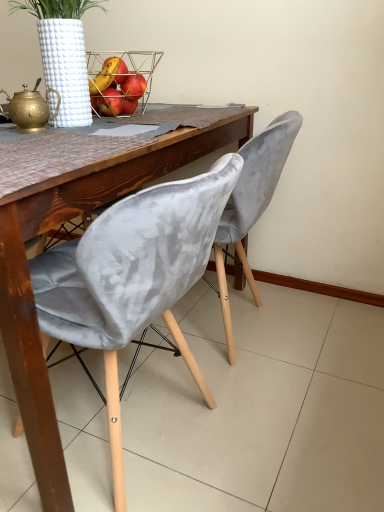
Locate an element on the screen. Image resolution: width=384 pixels, height=512 pixels. velvet grey chair at center, which is the 1th chair in back-to-front order is located at coordinates (252, 203).

This screenshot has height=512, width=384. What do you see at coordinates (120, 80) in the screenshot? I see `metallic wire basket at upper center` at bounding box center [120, 80].

Looking at this image, measure the distance between point (93,71) and camera.

Point (93,71) is 1.57 meters from camera.

Locate an element on the screen. The image size is (384, 512). velvet grey chair at center, positioned as the second chair in back-to-front order is located at coordinates (133, 273).

Between velvet grey chair at center, which is the 1th chair in back-to-front order, and velvet grey chair at center, positioned as the second chair in back-to-front order, which one appears on the left side from the viewer's perspective?

velvet grey chair at center, positioned as the second chair in back-to-front order, is more to the left.

From a real-world perspective, which is physically above, velvet grey chair at center, which is the 1th chair in back-to-front order, or velvet grey chair at center, which ranks as the 1th chair in front-to-back order?

In real-world perspective, velvet grey chair at center, which is the 1th chair in back-to-front order, is above.

In the scene shown: Considering the relative sizes of velvet grey chair at center, which is the 1th chair in back-to-front order, and velvet grey chair at center, positioned as the second chair in back-to-front order, in the image provided, is velvet grey chair at center, which is the 1th chair in back-to-front order, wider than velvet grey chair at center, positioned as the second chair in back-to-front order,?

No.

Does point (252, 218) come behind point (81, 287)?

Yes, it is behind point (81, 287).

Is velvet grey chair at center, which ranks as the 1th chair in front-to-back order, turned away from velvet grey chair at center, which is the 1th chair in back-to-front order?

No, velvet grey chair at center, which ranks as the 1th chair in front-to-back order, is not facing away from velvet grey chair at center, which is the 1th chair in back-to-front order.

Which is in front, velvet grey chair at center, positioned as the second chair in back-to-front order, or velvet grey chair at center, acting as the second chair starting from the front?

velvet grey chair at center, positioned as the second chair in back-to-front order, is closer to the camera.

Considering the relative sizes of velvet grey chair at center, positioned as the second chair in back-to-front order, and velvet grey chair at center, acting as the second chair starting from the front, in the image provided, is velvet grey chair at center, positioned as the second chair in back-to-front order, smaller than velvet grey chair at center, acting as the second chair starting from the front,?

No, velvet grey chair at center, positioned as the second chair in back-to-front order, is not smaller than velvet grey chair at center, acting as the second chair starting from the front.

From the image's perspective, which is above, velvet grey chair at center, which ranks as the 1th chair in front-to-back order, or velvet grey chair at center, acting as the second chair starting from the front?

velvet grey chair at center, acting as the second chair starting from the front.

How much distance is there between metallic wire basket at upper center and velvet grey chair at center, acting as the second chair starting from the front?

metallic wire basket at upper center and velvet grey chair at center, acting as the second chair starting from the front, are 19.96 inches apart from each other.

Considering the relative sizes of metallic wire basket at upper center and velvet grey chair at center, acting as the second chair starting from the front, in the image provided, is metallic wire basket at upper center shorter than velvet grey chair at center, acting as the second chair starting from the front,?

Yes, metallic wire basket at upper center is shorter than velvet grey chair at center, acting as the second chair starting from the front.

Does metallic wire basket at upper center appear on the right side of velvet grey chair at center, which is the 1th chair in back-to-front order?

No, metallic wire basket at upper center is not to the right of velvet grey chair at center, which is the 1th chair in back-to-front order.

Locate an element on the screen. Image resolution: width=384 pixels, height=512 pixels. basket on the left side of velvet grey chair at center, which is the 1th chair in back-to-front order is located at coordinates (120, 80).

Does velvet grey chair at center, positioned as the second chair in back-to-front order, appear on the left side of metallic wire basket at upper center?

Incorrect, velvet grey chair at center, positioned as the second chair in back-to-front order, is not on the left side of metallic wire basket at upper center.

From the image's perspective, is velvet grey chair at center, positioned as the second chair in back-to-front order, over metallic wire basket at upper center?

No, from the image's perspective, velvet grey chair at center, positioned as the second chair in back-to-front order, is not over metallic wire basket at upper center.

The height and width of the screenshot is (512, 384). What are the coordinates of `the 1st chair counting from the right of the metallic wire basket at upper center` in the screenshot? It's located at (x=133, y=273).

Between velvet grey chair at center, which ranks as the 1th chair in front-to-back order, and metallic wire basket at upper center, which one has smaller size?

metallic wire basket at upper center is smaller.

Looking at this image, considering the positions of objects velvet grey chair at center, which is the 1th chair in back-to-front order, and metallic wire basket at upper center in the image provided, who is in front, velvet grey chair at center, which is the 1th chair in back-to-front order, or metallic wire basket at upper center?

velvet grey chair at center, which is the 1th chair in back-to-front order, is in front.

Looking at this image, would you say metallic wire basket at upper center is part of velvet grey chair at center, acting as the second chair starting from the front,'s contents?

No, metallic wire basket at upper center is not a part of velvet grey chair at center, acting as the second chair starting from the front.

Is velvet grey chair at center, which is the 1th chair in back-to-front order, oriented away from metallic wire basket at upper center?

velvet grey chair at center, which is the 1th chair in back-to-front order, does not have its back to metallic wire basket at upper center.

Which is correct: metallic wire basket at upper center is inside velvet grey chair at center, which ranks as the 1th chair in front-to-back order, or outside of it?

metallic wire basket at upper center is spatially situated outside velvet grey chair at center, which ranks as the 1th chair in front-to-back order.

Is metallic wire basket at upper center at the right side of velvet grey chair at center, positioned as the second chair in back-to-front order?

No.

Identify the location of chair that is the 2nd object directly below the metallic wire basket at upper center (from a real-world perspective). (133, 273).

Could you tell me if metallic wire basket at upper center is facing velvet grey chair at center, positioned as the second chair in back-to-front order?

No, metallic wire basket at upper center is not turned towards velvet grey chair at center, positioned as the second chair in back-to-front order.

At what (x,y) coordinates should I click in order to perform the action: click on chair above the velvet grey chair at center, which ranks as the 1th chair in front-to-back order (from the image's perspective). Please return your answer as a coordinate pair (x, y). Looking at the image, I should click on (252, 203).

Identify the location of chair below the velvet grey chair at center, which is the 1th chair in back-to-front order (from the image's perspective). (133, 273).

Estimate the real-world distances between objects in this image. Which object is closer to velvet grey chair at center, which ranks as the 1th chair in front-to-back order, velvet grey chair at center, acting as the second chair starting from the front, or metallic wire basket at upper center?

velvet grey chair at center, acting as the second chair starting from the front, is closer to velvet grey chair at center, which ranks as the 1th chair in front-to-back order.

Looking at the image, which one is located closer to metallic wire basket at upper center, velvet grey chair at center, positioned as the second chair in back-to-front order, or velvet grey chair at center, which is the 1th chair in back-to-front order?

velvet grey chair at center, which is the 1th chair in back-to-front order, lies closer to metallic wire basket at upper center than the other object.

From the image, which object appears to be farther from velvet grey chair at center, acting as the second chair starting from the front, metallic wire basket at upper center or velvet grey chair at center, which ranks as the 1th chair in front-to-back order?

metallic wire basket at upper center.

Based on their spatial positions, is metallic wire basket at upper center or velvet grey chair at center, which is the 1th chair in back-to-front order, further from velvet grey chair at center, positioned as the second chair in back-to-front order?

The object further to velvet grey chair at center, positioned as the second chair in back-to-front order, is metallic wire basket at upper center.

When comparing their distances from metallic wire basket at upper center, does velvet grey chair at center, acting as the second chair starting from the front, or velvet grey chair at center, which ranks as the 1th chair in front-to-back order, seem closer?

Based on the image, velvet grey chair at center, acting as the second chair starting from the front, appears to be nearer to metallic wire basket at upper center.

Estimate the real-world distances between objects in this image. Which object is further from velvet grey chair at center, acting as the second chair starting from the front, velvet grey chair at center, which ranks as the 1th chair in front-to-back order, or metallic wire basket at upper center?

metallic wire basket at upper center is further to velvet grey chair at center, acting as the second chair starting from the front.

Locate an element on the screen. The height and width of the screenshot is (512, 384). chair that lies between metallic wire basket at upper center and velvet grey chair at center, positioned as the second chair in back-to-front order, from top to bottom is located at coordinates (252, 203).